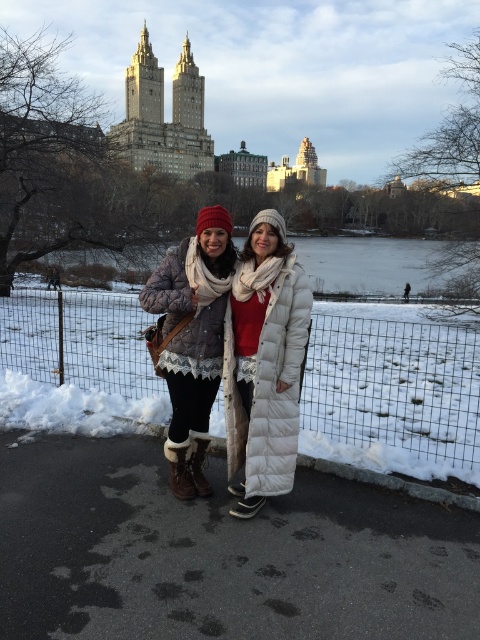
Between metal wire fence at lower center and matte black jacket at center, which one is positioned lower?

Positioned lower is matte black jacket at center.

From the picture: Between metal wire fence at lower center and matte black jacket at center, which one has less height?

metal wire fence at lower center is shorter.

This screenshot has width=480, height=640. What do you see at coordinates (393, 396) in the screenshot?
I see `metal wire fence at lower center` at bounding box center [393, 396].

At what (x,y) coordinates should I click in order to perform the action: click on metal wire fence at lower center. Please return your answer as a coordinate pair (x, y). The height and width of the screenshot is (640, 480). Looking at the image, I should click on (393, 396).

Does metal wire fence at lower center have a larger size compared to white down jacket at center?

Indeed, metal wire fence at lower center has a larger size compared to white down jacket at center.

Who is more distant from viewer, (363, 413) or (240, 438)?

The point (363, 413) is behind.

The height and width of the screenshot is (640, 480). I want to click on metal wire fence at lower center, so coord(393,396).

Does point (283, 458) lie in front of point (264, 236)?

Yes, point (283, 458) is in front of point (264, 236).

Who is more forward, (291, 326) or (237, 388)?

Point (291, 326) is in front.

Identify the location of matte black jacket at center. The width and height of the screenshot is (480, 640). (235, 346).